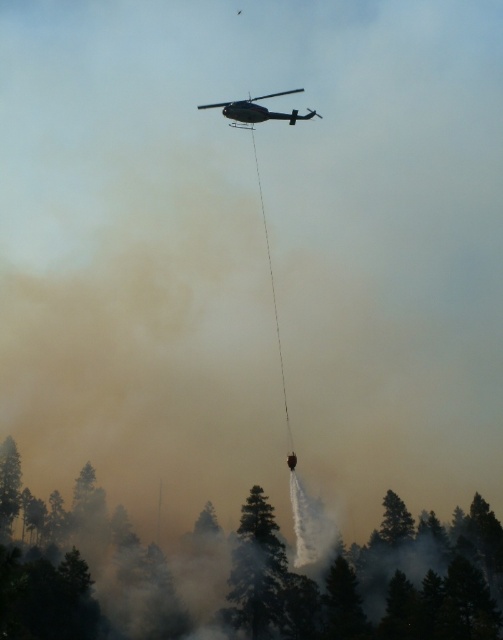
You are a firefighter pilot flying a helicopter to drop fire retardant on a wildfire. Your target is the point at coordinates point (494, 540). The helicopter is currently at an altitude of 400 feet. Can you safely release the retardant from this altitude to hit the target?

The point (494, 540) is 331.77 feet away from the viewer. Since the helicopter is at 400 feet altitude, it is higher than the target point. Therefore, you can safely release the retardant from this altitude to hit the target.

You are a drone operator trying to navigate between two points in the image. The first point is at coordinates point (256, 595) and the second is at point (211, 106). Which point is closer to you as you look at the image?

Point (256, 595) is closer to the camera than point (211, 106), so the first point is closer to you.

You are a firefighter pilot flying a helicopter at a high altitude. You notice a point of interest at coordinates point (243, 573). Your mission requires you to descend to this point to drop fire retardant. Can you safely descend to this point if your helicopter can descend to a minimum altitude of 50 meters?

The point (243, 573) is 84.19 meters from the camera. Since the helicopter can descend to a minimum altitude of 50 meters, it can safely descend to this point as 84.19 meters is above the minimum required altitude.